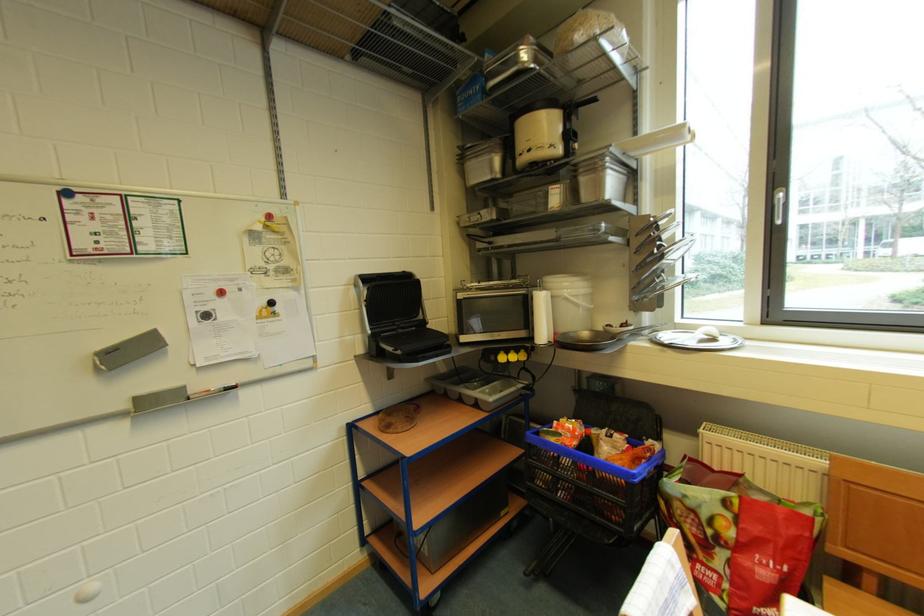
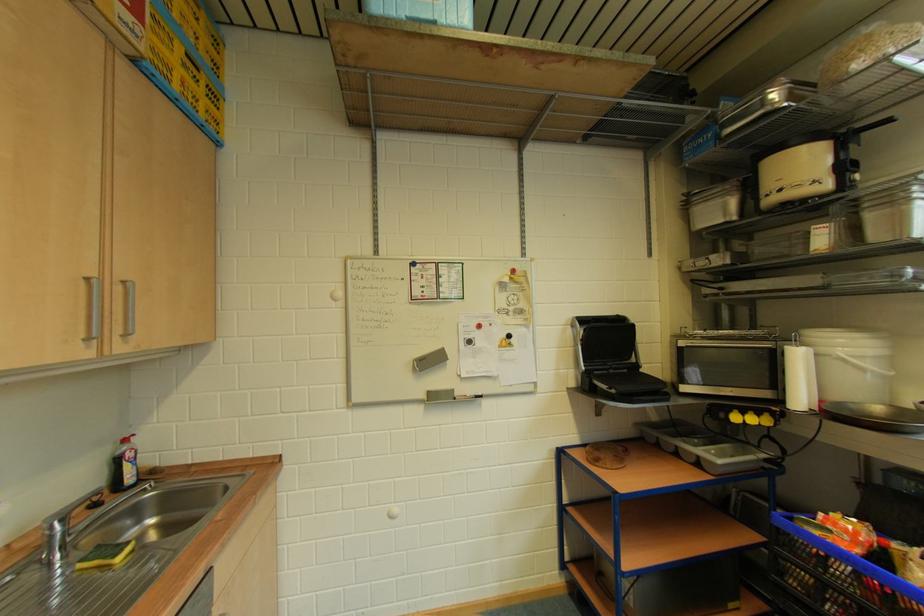
Locate, in the second image, the point that corresponds to point (362, 288) in the first image.

(579, 329)